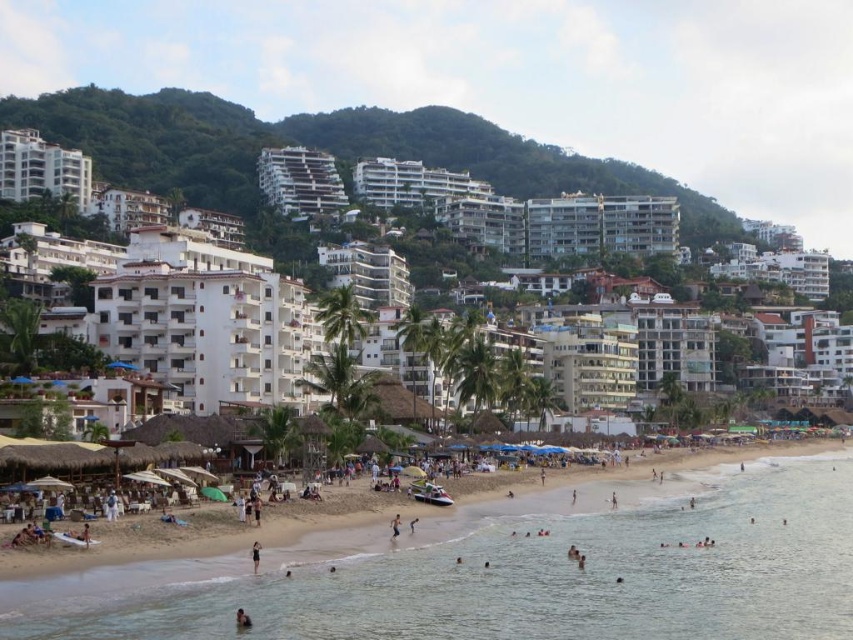
You are standing at the beach and looking towards the buildings. There are two points marked on your view, point 1 at position (699, 212) and point 2 at position (39, 189). Which point is closer to you?

Point 1 at position (699, 212) is closer to you because it is further to the viewer than point 2 at position (39, 189).

You are a photographer planning to capture the beach scene. You want to ensure that both the clear blue water at lower center and the green leafy hillside at upper center are visible in your shot. Based on their sizes in the image, which of these two elements will occupy a larger portion of the frame?

The green leafy hillside at upper center occupies a larger portion of the frame since it is bigger than the clear blue water at lower center.